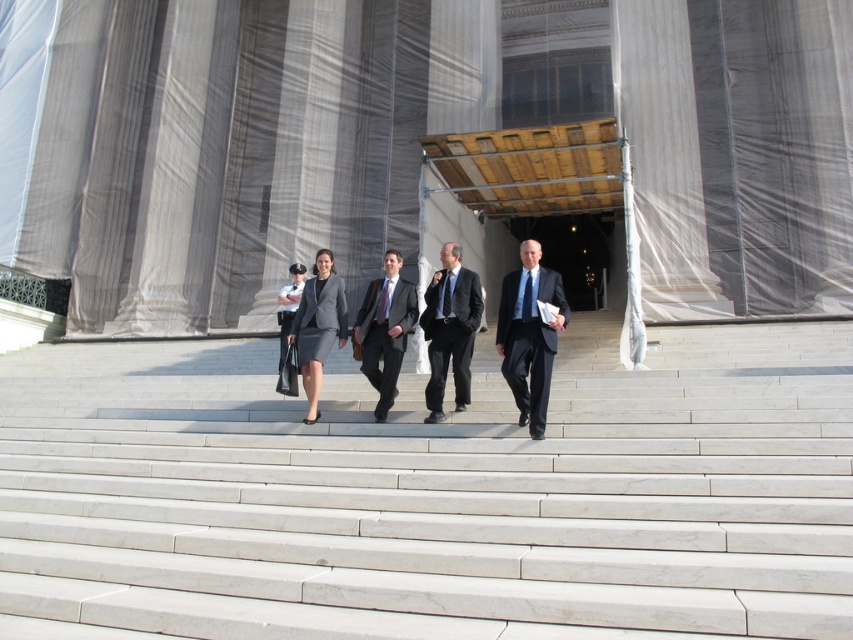
Question: Which object is farther from the camera taking this photo?

Choices:
 (A) matte black dress at center
 (B) dark gray suit at center

Answer: (A)

Question: Which of the following is the closest to the observer?

Choices:
 (A) matte black dress at center
 (B) white marble stairs at center
 (C) matte gray suit at center

Answer: (B)

Question: Is dark blue suit at center thinner than dark gray suit at center?

Choices:
 (A) yes
 (B) no

Answer: (A)

Question: Does matte gray suit at center have a lesser width compared to matte gray dress at center?

Choices:
 (A) yes
 (B) no

Answer: (A)

Question: Estimate the real-world distances between objects in this image. Which object is closer to the matte black suit at center?

Choices:
 (A) matte gray dress at center
 (B) white marble stairs at center
 (C) dark blue suit at center

Answer: (A)

Question: Is dark gray suit at center wider than matte black dress at center?

Choices:
 (A) no
 (B) yes

Answer: (B)